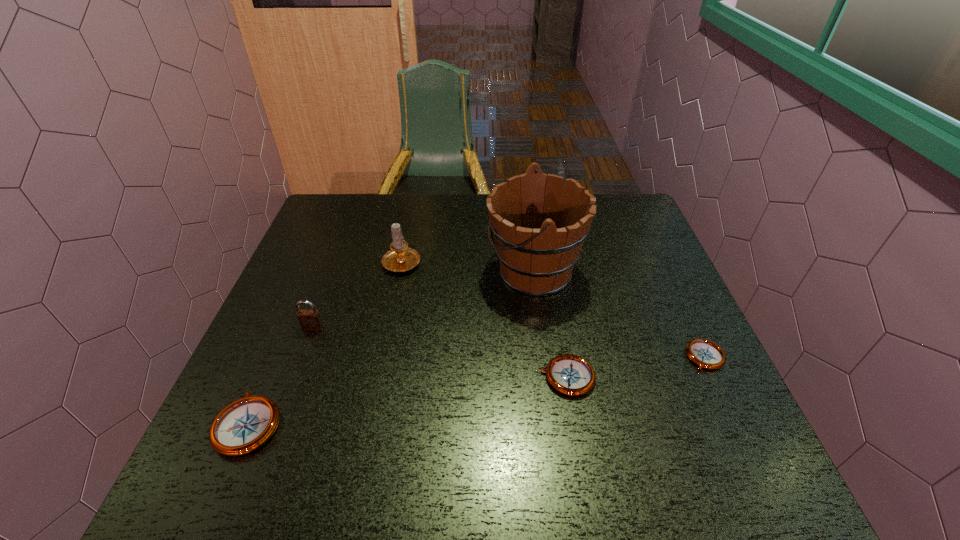
Locate an element on the screen. The height and width of the screenshot is (540, 960). padlock that is at the left edge is located at coordinates (310, 320).

The image size is (960, 540). I want to click on object located at the right edge, so [706, 354].

Find the location of `object located in the near left corner section of the desktop`. object located in the near left corner section of the desktop is located at coordinates (243, 426).

This screenshot has width=960, height=540. I want to click on vacant region at the far edge of the desktop, so click(x=391, y=214).

You are a GUI agent. You are given a task and a screenshot of the screen. Output one action in this format:
    pyautogui.click(x=<x>, y=<y>)
    Task: Click on the free spot at the left edge of the desktop
    The height and width of the screenshot is (540, 960).
    Given the screenshot: What is the action you would take?
    pyautogui.click(x=277, y=368)

The height and width of the screenshot is (540, 960). In the image, there is a desktop. What are the coordinates of `vacant region at the right edge` in the screenshot? It's located at (616, 252).

The image size is (960, 540). In order to click on vacant region at the far left corner in this screenshot , I will do `click(357, 194)`.

Image resolution: width=960 pixels, height=540 pixels. Find the location of `vacant space at the far right corner of the desktop`. vacant space at the far right corner of the desktop is located at coordinates (599, 203).

In the image, there is a desktop. At what (x,y) coordinates should I click in order to perform the action: click on vacant space at the near right corner. Please return your answer as a coordinate pair (x, y). Looking at the image, I should click on (689, 410).

At what (x,y) coordinates should I click in order to perform the action: click on unoccupied position between the candle and the tallest object. Please return your answer as a coordinate pair (x, y). Looking at the image, I should click on (468, 266).